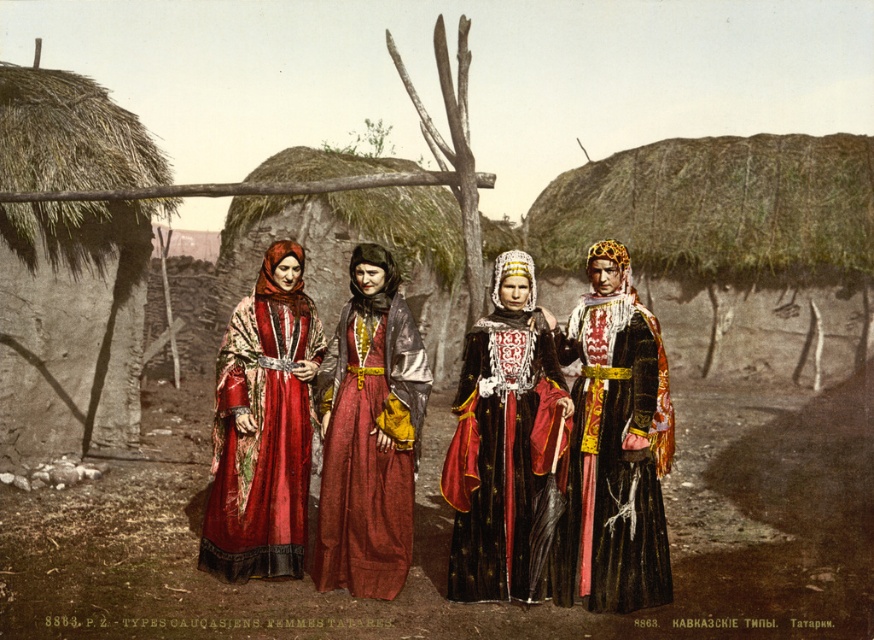
You are a photographer planning to take a group photo of the black velvet dress at center and the matte red dress at center. Which dress should you position closer to the camera to ensure both appear equally tall in the photo?

The black velvet dress at center is not as tall as the matte red dress at center, so you should position the black velvet dress at center closer to the camera to make them appear the same height.

You are a photographer positioned at the origin point of the image. You need to capture a closeup shot of the black velvet dress at center. Which direction should you move to get closer to it?

The black velvet dress at center is located at point (615, 460), so you should move towards the coordinates to get closer to it.